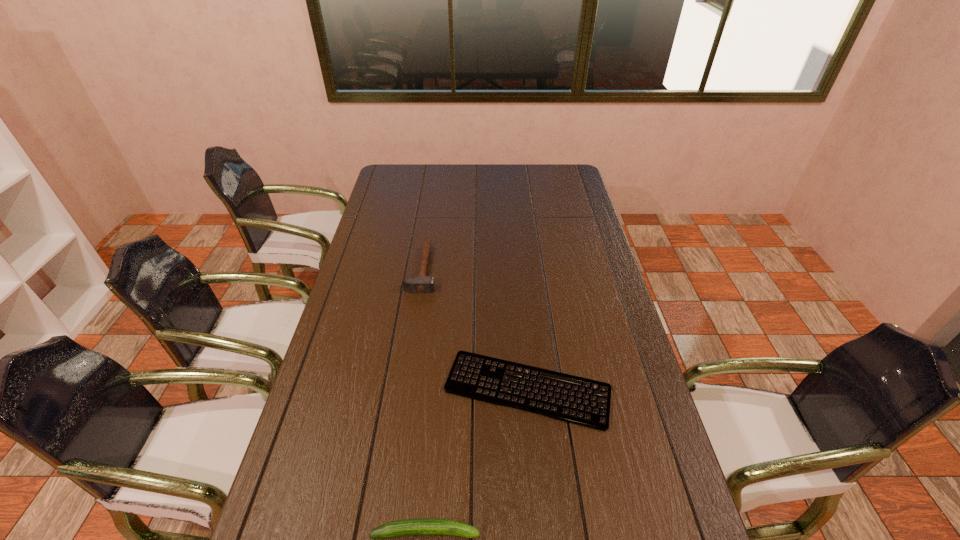
The width and height of the screenshot is (960, 540). I want to click on free space at the far right corner of the desktop, so click(545, 173).

The height and width of the screenshot is (540, 960). I want to click on unoccupied area between the tallest object and the computer keyboard, so click(475, 329).

This screenshot has width=960, height=540. Find the location of `blank region between the hammer and the second nearest object`. blank region between the hammer and the second nearest object is located at coordinates (475, 329).

The height and width of the screenshot is (540, 960). I want to click on object that is the second closest to the zucchini, so click(x=414, y=284).

Identify which object is the second nearest to the tallest object. Please provide its 2D coordinates. Your answer should be formatted as a tuple, i.e. [(x, y)], where the tuple contains the x and y coordinates of a point satisfying the conditions above.

[(410, 527)]

You are a GUI agent. You are given a task and a screenshot of the screen. Output one action in this format:
    pyautogui.click(x=<x>, y=<y>)
    Task: Click on the free space that satisfies the following two spatial constraints: 1. on the striking surface of the tallest object; 2. on the left side of the computer keyboard
    
    Given the screenshot: What is the action you would take?
    pyautogui.click(x=404, y=389)

Image resolution: width=960 pixels, height=540 pixels. Find the location of `vacant position in the image that satisfies the following two spatial constraints: 1. on the striking surface of the farthest object; 2. on the right side of the shortest object`. vacant position in the image that satisfies the following two spatial constraints: 1. on the striking surface of the farthest object; 2. on the right side of the shortest object is located at coordinates (404, 389).

You are a GUI agent. You are given a task and a screenshot of the screen. Output one action in this format:
    pyautogui.click(x=<x>, y=<y>)
    Task: Click on the free point that satisfies the following two spatial constraints: 1. on the striking surface of the hammer; 2. on the left side of the shortest object
    
    Given the screenshot: What is the action you would take?
    pyautogui.click(x=404, y=389)

At what (x,y) coordinates should I click in order to perform the action: click on vacant space that satisfies the following two spatial constraints: 1. on the striking surface of the farthest object; 2. on the left side of the second farthest object. Please return your answer as a coordinate pair (x, y). This screenshot has width=960, height=540. Looking at the image, I should click on (404, 389).

Identify the location of blank space that satisfies the following two spatial constraints: 1. on the striking surface of the shortest object; 2. on the left side of the hammer. This screenshot has height=540, width=960. (404, 389).